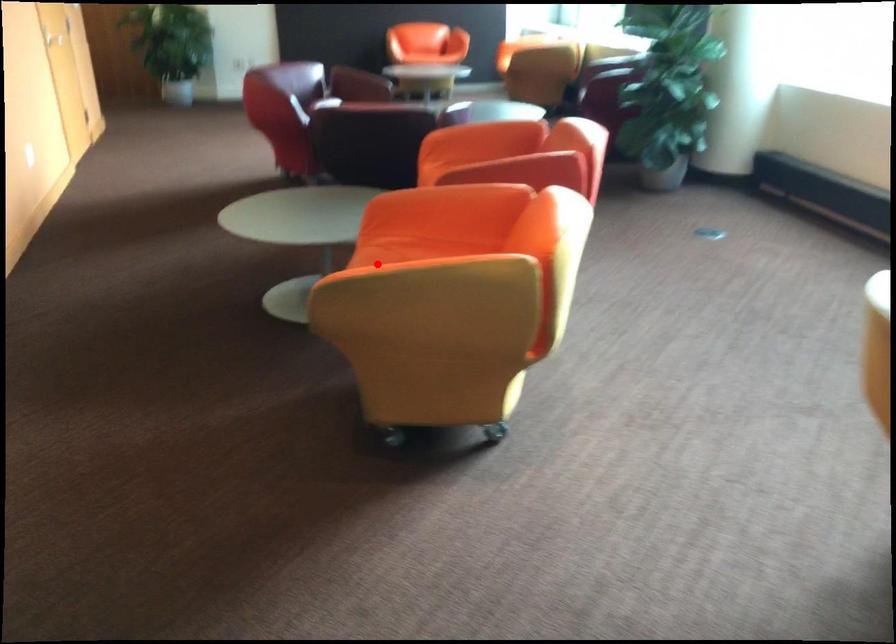
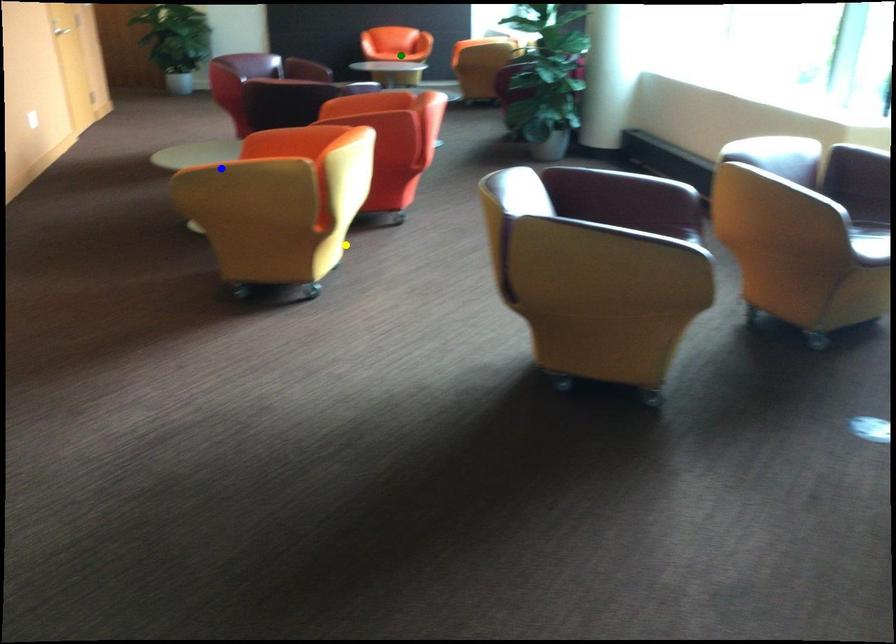
Question: I am providing you with two images of the same scene from different viewpoints. A red point is marked on the first image. You are given multiple points on the second image. Which point in image 2 is actually the same real-world point as the red point in image 1?

Choices:
 (A) green point
 (B) yellow point
 (C) blue point

Answer: (C)